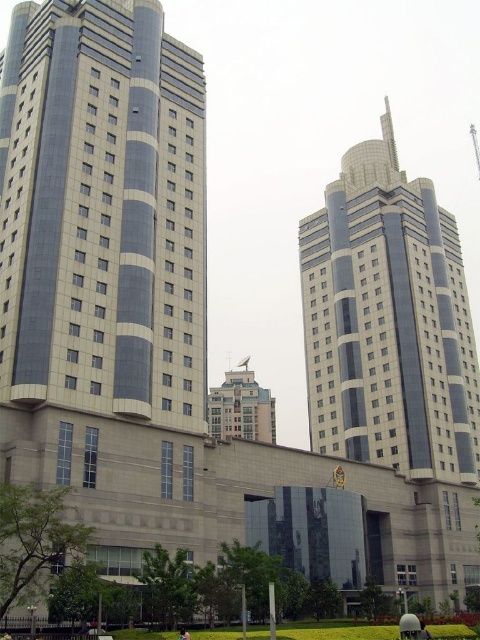
You are standing in front of the two highrise buildings and notice the smooth glass tower at center and the light brown fabric shirt at center. Which object is wider?

The smooth glass tower at center is wider than the light brown fabric shirt at center.

You are standing in front of the two high rise buildings and notice a person wearing a light brown fabric shirt at center. Can you see the smooth glass tower at center from your current position without moving your head?

Yes, because the smooth glass tower at center is located above the light brown fabric shirt at center, so it should be visible above the person.

You are standing in front of the complex of buildings and want to take a photo. You notice two points marked in the image. Which point, point (452, 481) or point (187, 634), is closer to your camera lens?

Point (187, 634) is closer to the camera lens because the description states that point (452, 481) is further away than point (187, 634).